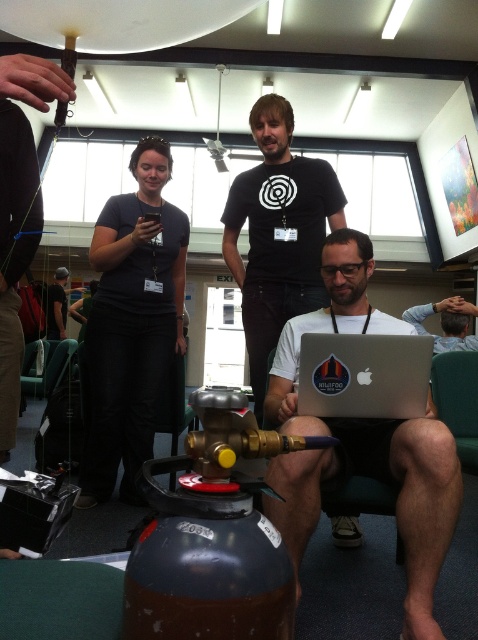
Question: Considering the relative positions of white matte laptop at lower center and silver metallic laptop at center in the image provided, where is white matte laptop at lower center located with respect to silver metallic laptop at center?

Choices:
 (A) right
 (B) left

Answer: (B)

Question: Which object appears closest to the camera in this image?

Choices:
 (A) silver metallic laptop at center
 (B) white matte laptop at lower center

Answer: (B)

Question: Is white matte laptop at lower center positioned at the back of dark gray fabric shirt at upper left?

Choices:
 (A) yes
 (B) no

Answer: (B)

Question: Can you confirm if white matte laptop at lower center is thinner than silver metallic laptop at center?

Choices:
 (A) no
 (B) yes

Answer: (A)

Question: Which is nearer to the black matte t-shirt at center?

Choices:
 (A) silver metallic laptop at center
 (B) white matte laptop at lower center
 (C) dark gray fabric shirt at upper left

Answer: (C)

Question: Among these points, which one is farthest from the camera?

Choices:
 (A) (119, 273)
 (B) (280, 136)

Answer: (A)